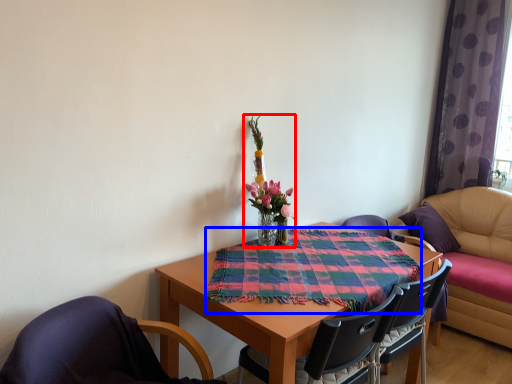
Question: Which object is further to the camera taking this photo, floral arrangement (highlighted by a red box) or cloth (highlighted by a blue box)?

Choices:
 (A) floral arrangement
 (B) cloth

Answer: (A)